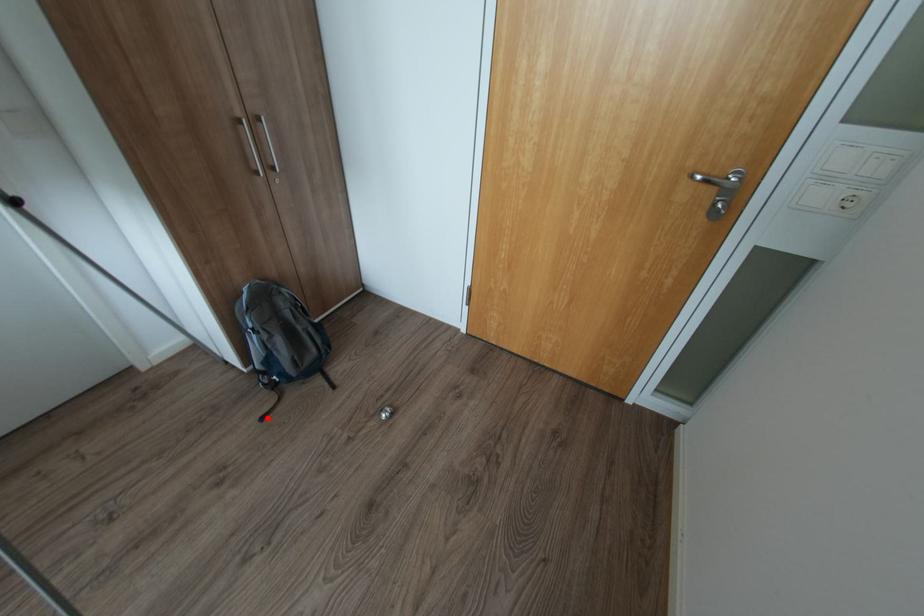
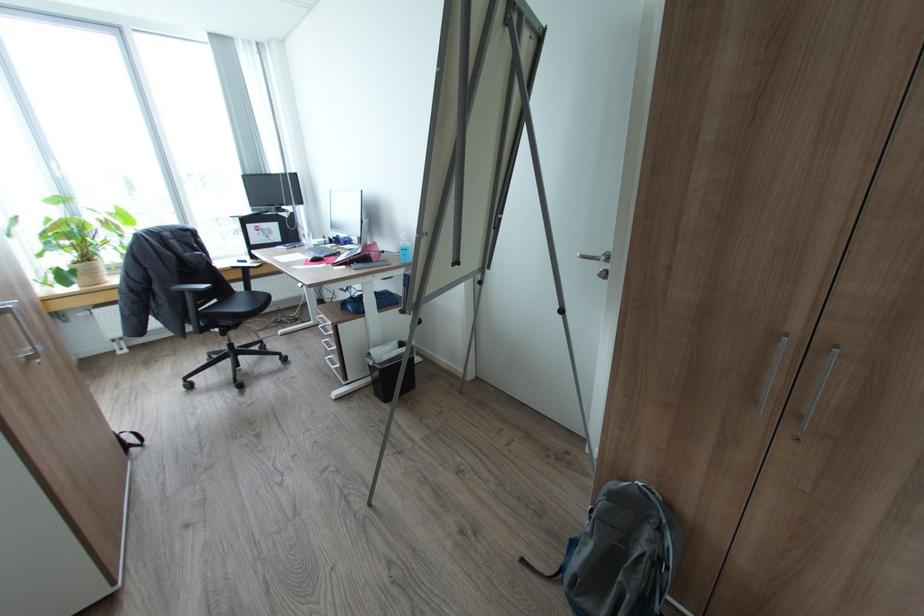
Locate, in the second image, the point that corresponds to the highlighted location in the first image.

(527, 560)